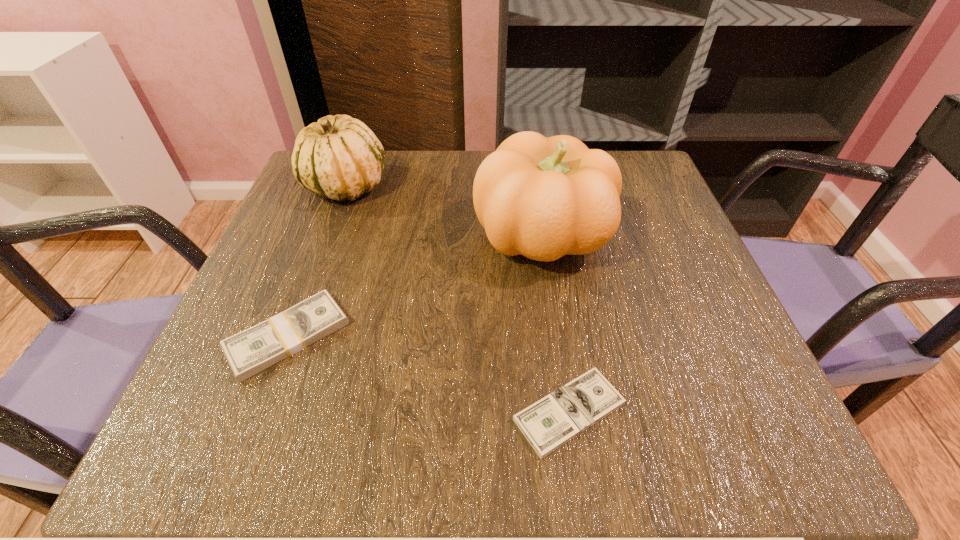
Find the location of a particular element. free space at the left edge of the desktop is located at coordinates (285, 233).

You are a GUI agent. You are given a task and a screenshot of the screen. Output one action in this format:
    pyautogui.click(x=<x>, y=<y>)
    Task: Click on the free space at the right edge of the desktop
    This screenshot has height=540, width=960.
    Given the screenshot: What is the action you would take?
    pyautogui.click(x=700, y=333)

The width and height of the screenshot is (960, 540). In the image, there is a desktop. In order to click on vacant space at the near left corner in this screenshot , I will do `click(191, 458)`.

Locate an element on the screen. free space at the far right corner of the desktop is located at coordinates (x=642, y=152).

The height and width of the screenshot is (540, 960). I want to click on unoccupied position between the shorter dollar and the third shortest object, so click(x=457, y=299).

Identify the location of empty space that is in between the shorter dollar and the second shortest object. (429, 374).

Where is `vacant space that is in between the shortest object and the second tallest object`? This screenshot has height=540, width=960. vacant space that is in between the shortest object and the second tallest object is located at coordinates (457, 299).

The width and height of the screenshot is (960, 540). What are the coordinates of `free space between the tallest object and the gourd` in the screenshot? It's located at (444, 211).

The height and width of the screenshot is (540, 960). I want to click on empty space that is in between the tallest object and the third shortest object, so click(x=444, y=211).

Where is `free space between the tallest object and the shorter dollar`? free space between the tallest object and the shorter dollar is located at coordinates (556, 323).